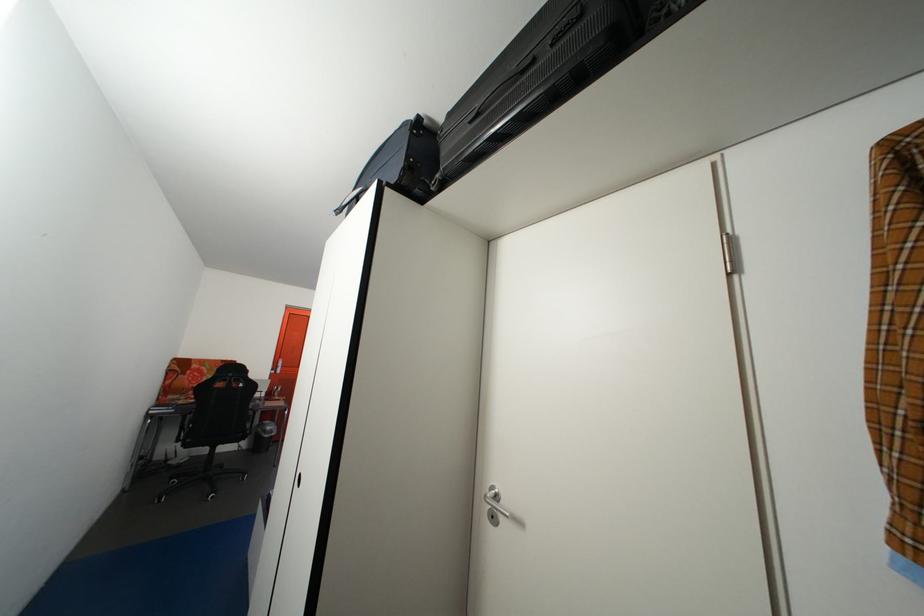
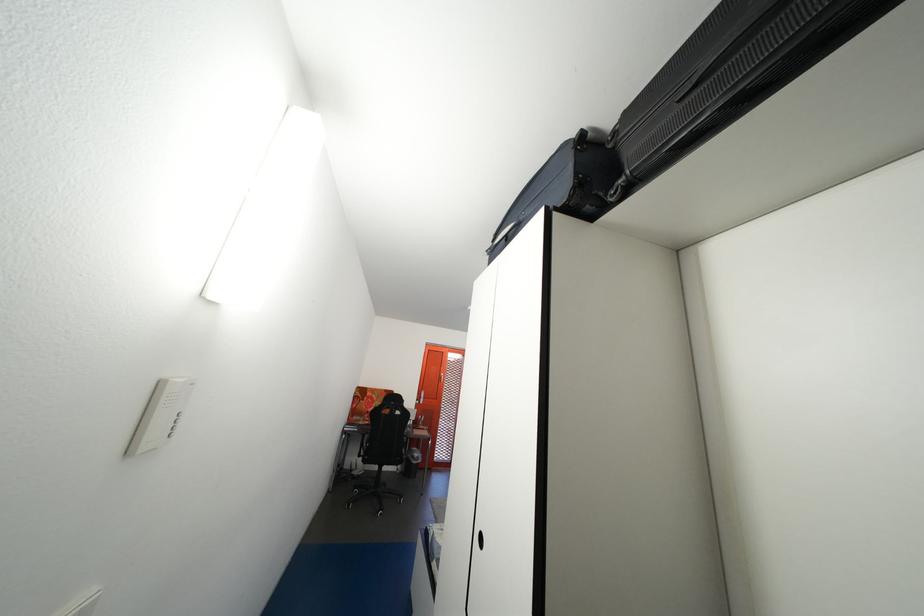
Where in the second image is the point corresponding to point (181, 403) from the first image?

(367, 424)